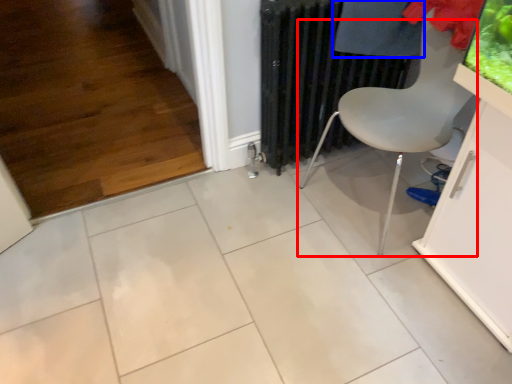
Question: Which of the following is the closest to the observer, chair (highlighted by a red box) or clothing (highlighted by a blue box)?

Choices:
 (A) chair
 (B) clothing

Answer: (A)